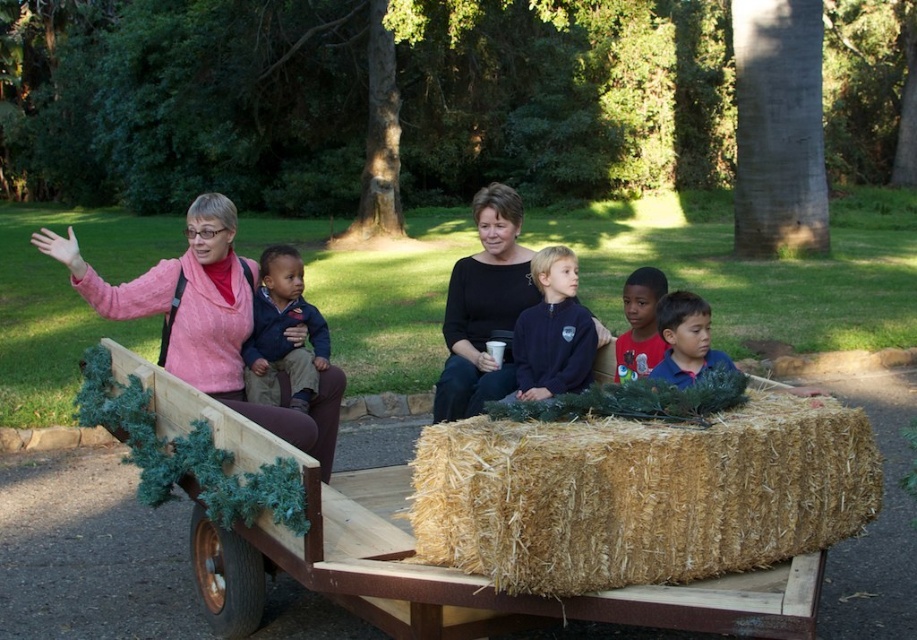
Question: Which point is closer to the camera taking this photo?

Choices:
 (A) (222, 566)
 (B) (487, 365)
 (C) (656, 278)

Answer: (A)

Question: Does pink sweater at left have a greater width compared to blue shirt at center?

Choices:
 (A) yes
 (B) no

Answer: (A)

Question: Which of these objects is positioned closest to the bleached straw bale at center?

Choices:
 (A) matte blue jacket at center
 (B) navy blue fleece at center

Answer: (B)

Question: From the image, what is the correct spatial relationship of wooden wagon at center in relation to matte blue jacket at center?

Choices:
 (A) above
 (B) below

Answer: (B)

Question: Which object appears closest to the camera in this image?

Choices:
 (A) smooth blue shirt at center
 (B) matte blue jacket at center
 (C) blue shirt at center

Answer: (C)

Question: Can you confirm if pink sweater at left is bigger than navy blue fleece at center?

Choices:
 (A) no
 (B) yes

Answer: (B)